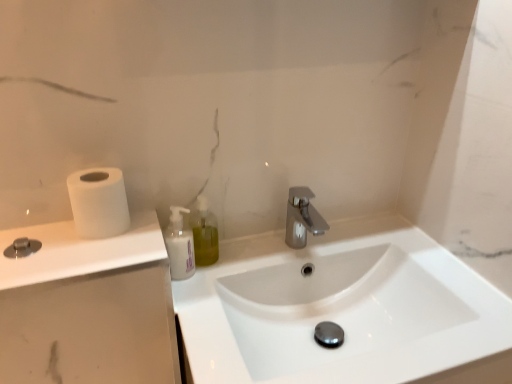
Where is `free space to the left of white matte toilet paper at left`? Image resolution: width=512 pixels, height=384 pixels. free space to the left of white matte toilet paper at left is located at coordinates (41, 232).